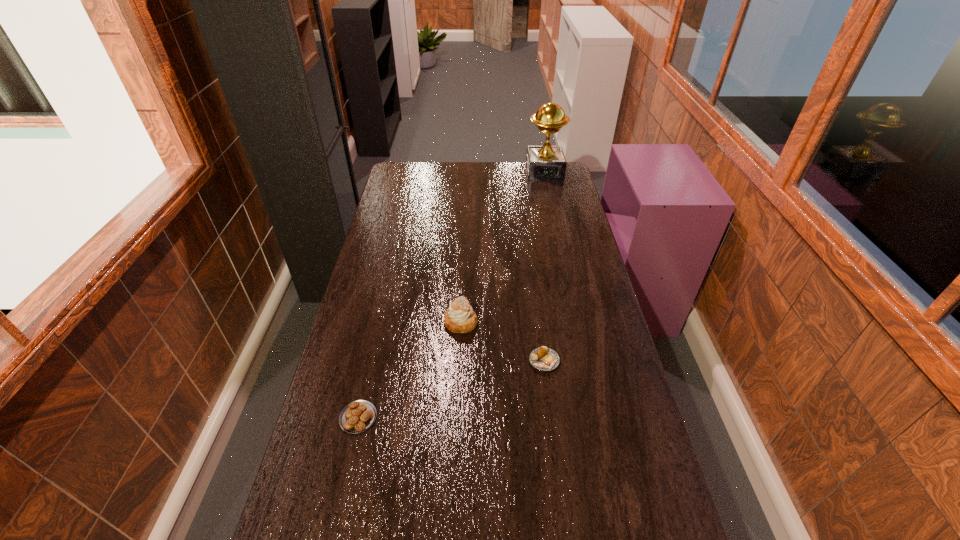
Where is `the tallest object`? The width and height of the screenshot is (960, 540). the tallest object is located at coordinates (546, 162).

Find the location of a particular element. This screenshot has height=540, width=960. award is located at coordinates (546, 162).

Find the location of a particular element. Image resolution: width=960 pixels, height=540 pixels. the tallest pastry is located at coordinates (460, 318).

This screenshot has width=960, height=540. What are the coordinates of `the second farthest object` in the screenshot? It's located at (460, 318).

Where is `the second tallest pastry`? the second tallest pastry is located at coordinates (545, 359).

You are a GUI agent. You are given a task and a screenshot of the screen. Output one action in this format:
    pyautogui.click(x=<x>, y=<y>)
    Task: Click on the second nearest pastry
    
    Given the screenshot: What is the action you would take?
    pyautogui.click(x=545, y=359)

I want to click on the leftmost object, so click(358, 416).

Identify the location of the shortest pastry. tap(358, 416).

At what (x,y) coordinates should I click in order to perform the action: click on vacant space located on the front-facing side of the award. Please return your answer as a coordinate pair (x, y). Looking at the image, I should click on (553, 209).

The image size is (960, 540). I want to click on vacant space located 0.250m on the right of the third shortest object, so click(553, 322).